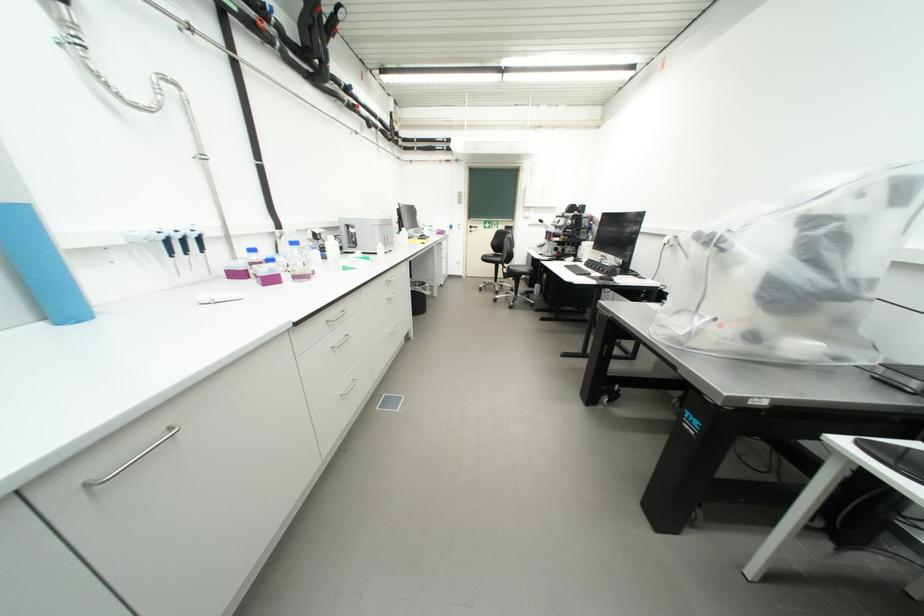
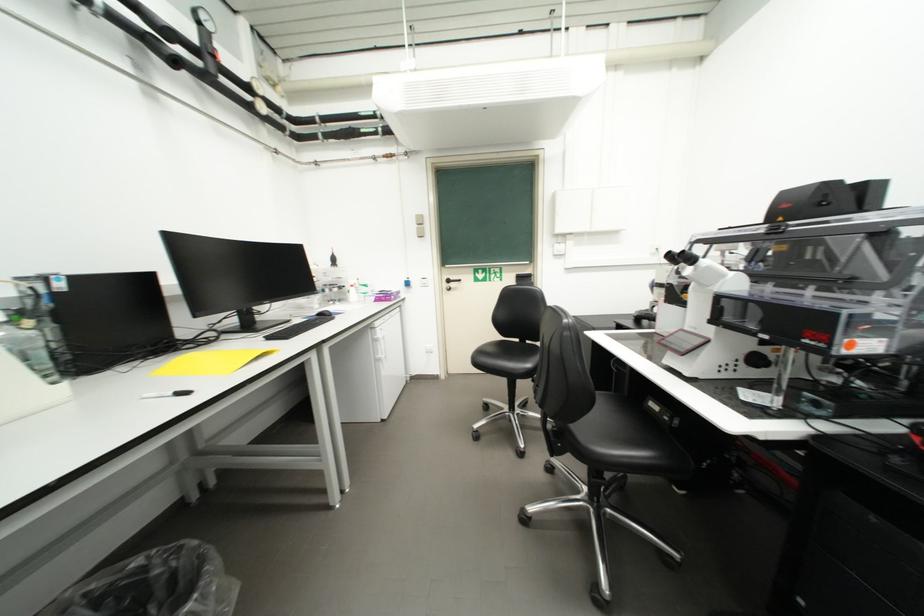
In the second image, find the point that corresponds to [493,261] in the first image.

(490, 362)